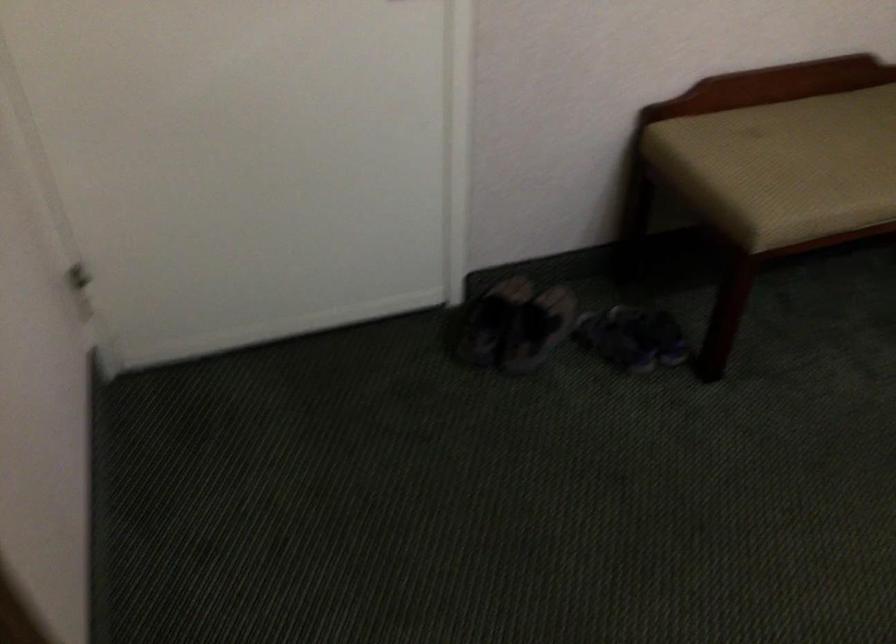
Which object does [513,325] point to?

It corresponds to the dark shoes in the image.